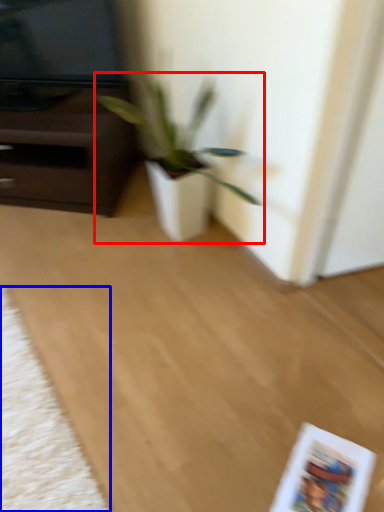
Question: Which object is closer to the camera taking this photo, houseplant (highlighted by a red box) or mat (highlighted by a blue box)?

Choices:
 (A) houseplant
 (B) mat

Answer: (B)